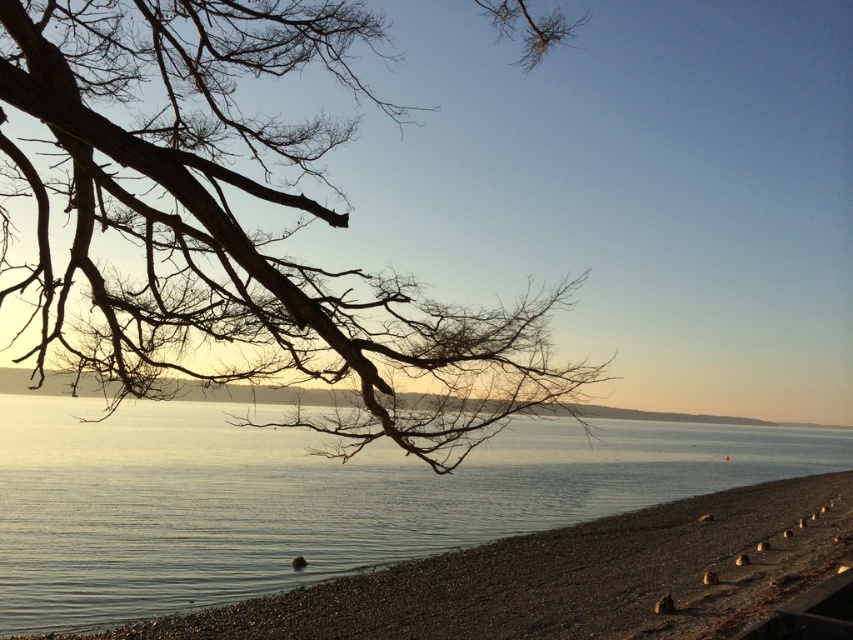
Who is shorter, brown/dry wood branches at upper left or transparent water at center?

With less height is brown/dry wood branches at upper left.

How much distance is there between brown/dry wood branches at upper left and transparent water at center?

brown/dry wood branches at upper left is 7.56 meters away from transparent water at center.

Find the location of a particular element. brown/dry wood branches at upper left is located at coordinates (235, 225).